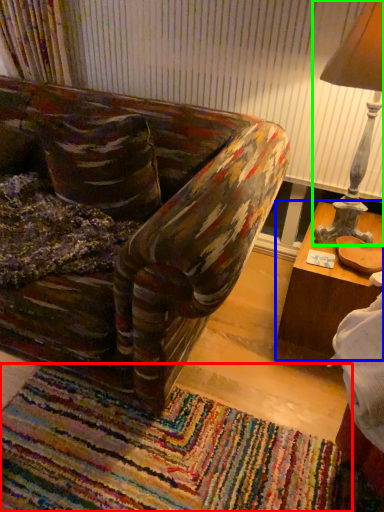
Question: Based on their relative distances, which object is farther from mat (highlighted by a red box)? Choose from table (highlighted by a blue box) and table lamp (highlighted by a green box).

Choices:
 (A) table
 (B) table lamp

Answer: (B)